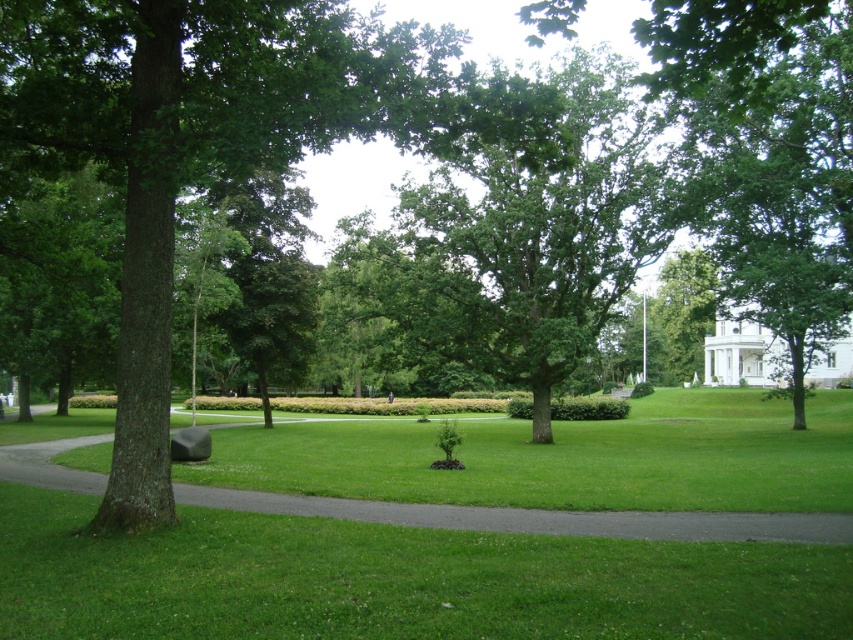
Which is in front, point (393, 284) or point (99, 492)?

Positioned in front is point (99, 492).

The height and width of the screenshot is (640, 853). Describe the element at coordinates (520, 227) in the screenshot. I see `green leafy tree at center` at that location.

Which is behind, point (526, 195) or point (517, 529)?

The point (526, 195) is more distant.

Locate an element on the screen. green leafy tree at center is located at coordinates (520, 227).